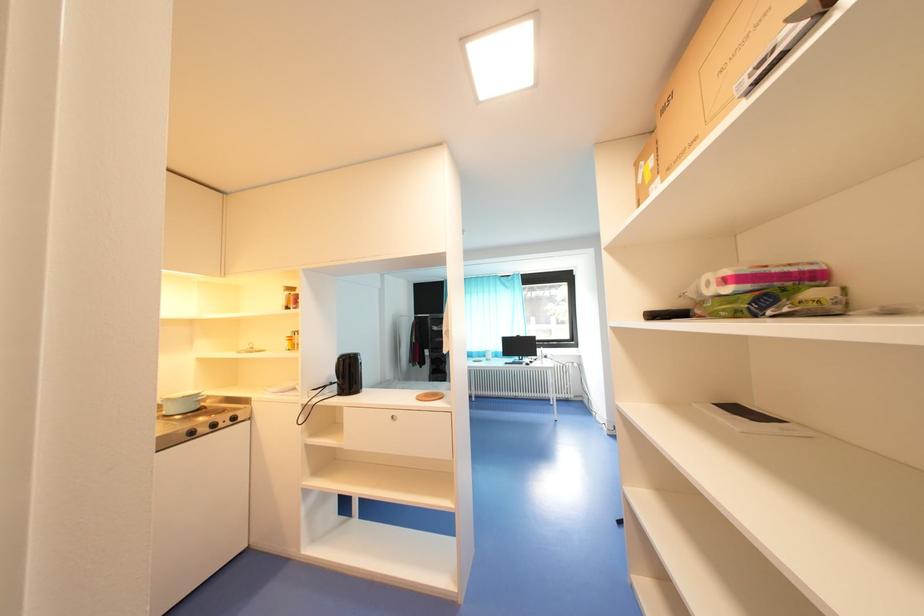
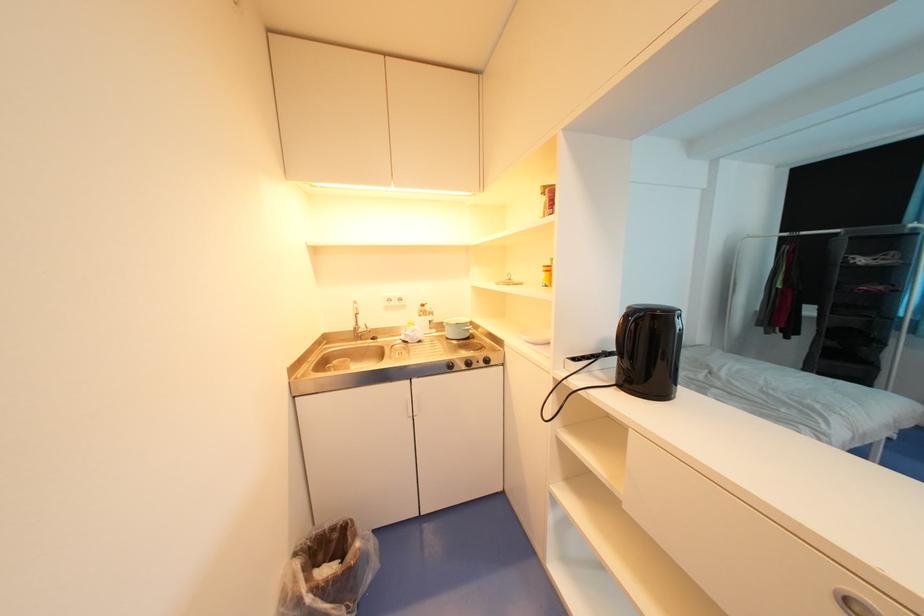
Question: The camera is either moving clockwise (left) or counter-clockwise (right) around the object. The first image is from the beginning of the video and the second image is from the end. Is the camera moving left or right when shooting the video?

Choices:
 (A) Left
 (B) Right

Answer: (B)